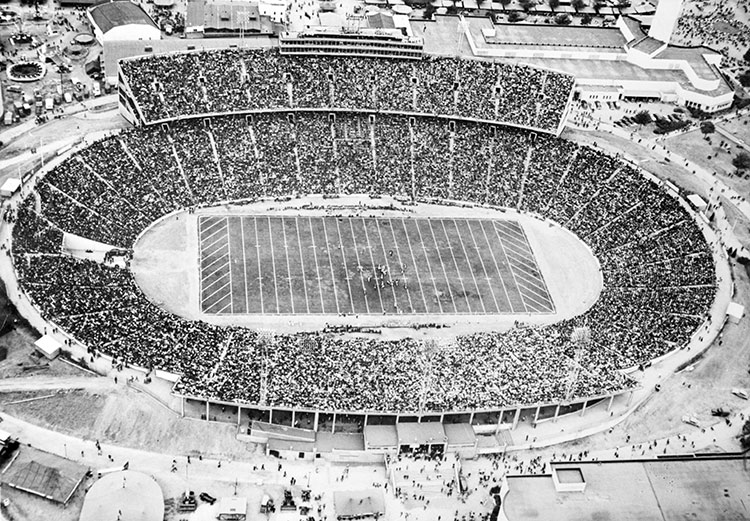
Identify the location of booth. Image resolution: width=750 pixels, height=521 pixels. (388, 41).